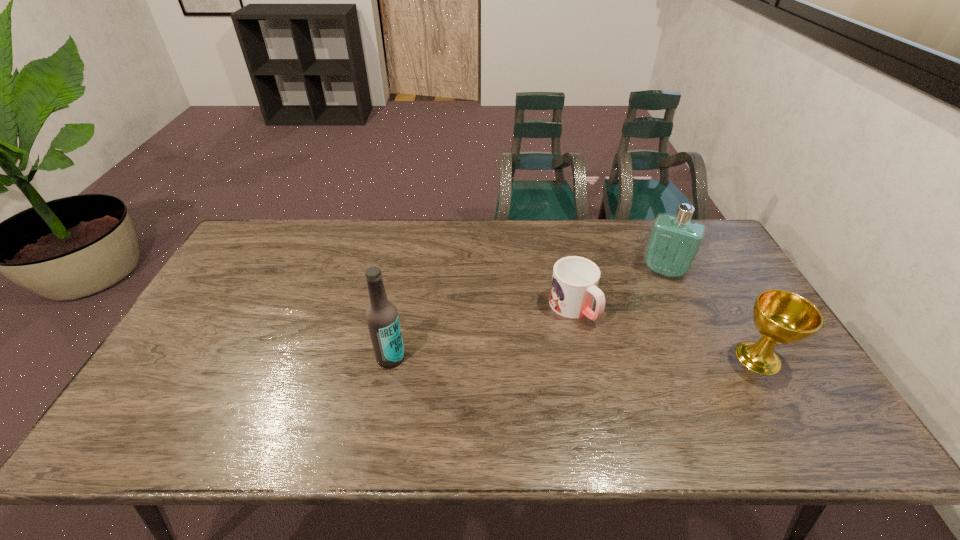
You are a GUI agent. You are given a task and a screenshot of the screen. Output one action in this format:
    pyautogui.click(x=<x>, y=<y>)
    Task: Click on the vacant area at the far edge of the desktop
    The width and height of the screenshot is (960, 540).
    Given the screenshot: What is the action you would take?
    pyautogui.click(x=356, y=225)

At what (x,y) coordinates should I click in order to perform the action: click on free space at the near edge. Please return your answer as a coordinate pair (x, y). Looking at the image, I should click on (606, 383).

Image resolution: width=960 pixels, height=540 pixels. What are the coordinates of `vacant space at the left edge of the desktop` in the screenshot? It's located at (239, 275).

The height and width of the screenshot is (540, 960). In the image, there is a desktop. Find the location of `free region at the right edge`. free region at the right edge is located at coordinates (702, 287).

Find the location of `vacant area at the far left corner`. vacant area at the far left corner is located at coordinates (266, 220).

Identify the location of vacant space at the near left corner of the desktop. The width and height of the screenshot is (960, 540). (197, 400).

Find the location of a particular element. free location at the far right corner of the desktop is located at coordinates (713, 249).

Locate an element on the screen. Image resolution: width=960 pixels, height=540 pixels. vacant area that lies between the third object from right to left and the third shortest object is located at coordinates (618, 289).

This screenshot has height=540, width=960. Find the location of `free space between the third object from right to left and the tallest object`. free space between the third object from right to left and the tallest object is located at coordinates (482, 333).

Identify the location of free space between the tallest object and the third object from right to left. (482, 333).